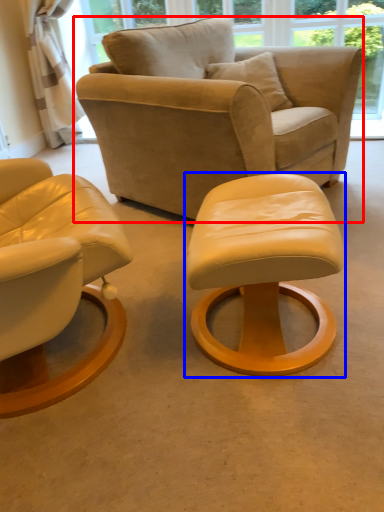
Question: Which point is further to the camera, chair (highlighted by a red box) or stool (highlighted by a blue box)?

Choices:
 (A) chair
 (B) stool

Answer: (A)